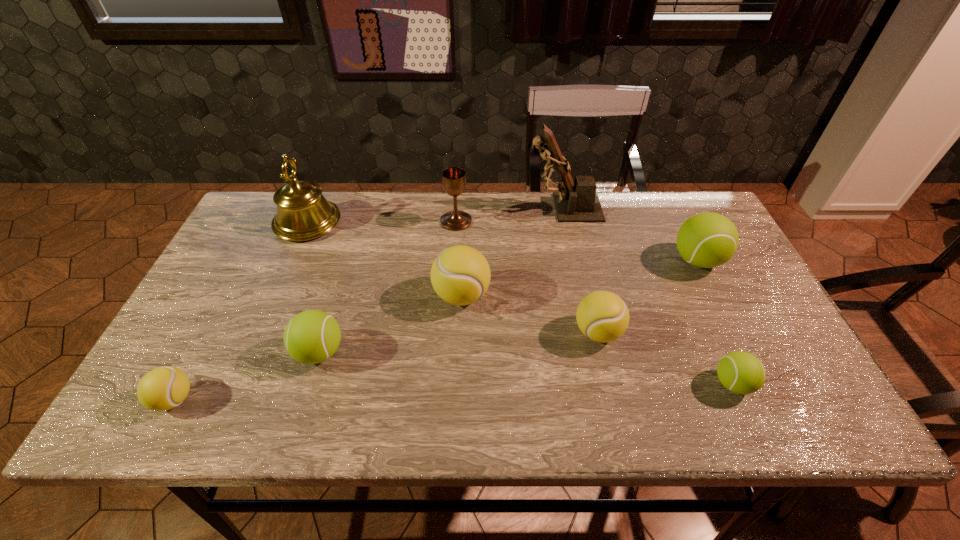
Locate an element on the screen. The width and height of the screenshot is (960, 540). the rightmost yellow tennis ball is located at coordinates [x=602, y=316].

This screenshot has height=540, width=960. Identify the location of the third tennis ball from right to left. (602, 316).

The width and height of the screenshot is (960, 540). I want to click on the smallest green tennis ball, so click(740, 372).

The image size is (960, 540). What are the coordinates of `the nearest yellow tennis ball` in the screenshot? It's located at [x=164, y=388].

Image resolution: width=960 pixels, height=540 pixels. I want to click on the smallest yellow tennis ball, so click(164, 388).

Identify the location of free space located on the front-facing side of the figurine. Image resolution: width=960 pixels, height=540 pixels. (445, 207).

Image resolution: width=960 pixels, height=540 pixels. In order to click on free spot located on the front-facing side of the figurine in this screenshot , I will do `click(433, 207)`.

The image size is (960, 540). I want to click on vacant space located 0.070m on the front-facing side of the figurine, so click(x=505, y=207).

Image resolution: width=960 pixels, height=540 pixels. In order to click on free location located 0.170m on the front of the second tallest object in this screenshot , I will do `click(279, 287)`.

In order to click on vacant region located on the front of the chalice in this screenshot , I will do `click(454, 254)`.